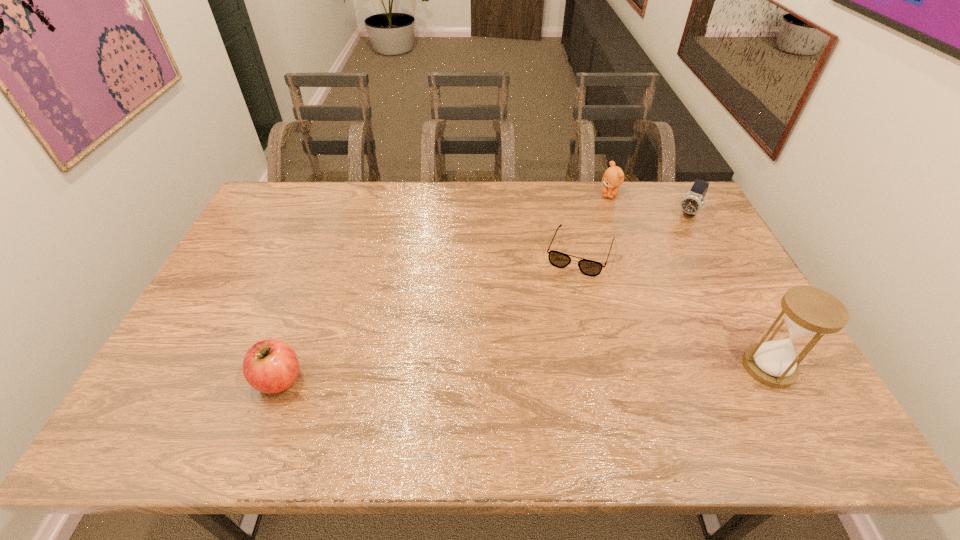
The height and width of the screenshot is (540, 960). Identify the location of vacant space at the near right corner. (770, 392).

This screenshot has width=960, height=540. Identify the location of free spot between the spectacles and the watch. (635, 233).

Identify the location of free space between the shortest object and the farthest object. (595, 224).

Find the location of a particular element. This screenshot has width=960, height=540. free space between the farthest object and the hourglass is located at coordinates (689, 281).

The height and width of the screenshot is (540, 960). In order to click on vacant space in between the second farthest object and the shortest object in this screenshot , I will do `click(635, 233)`.

The width and height of the screenshot is (960, 540). Identify the location of empty location between the tallest object and the farthest object. (689, 281).

Where is `unoccupied area between the apple and the farthest object`? This screenshot has width=960, height=540. unoccupied area between the apple and the farthest object is located at coordinates (444, 287).

Find the location of a particular element. The width and height of the screenshot is (960, 540). vacant region between the farthest object and the leftmost object is located at coordinates (444, 287).

Locate an element on the screen. free space that is in between the farthest object and the apple is located at coordinates (444, 287).

What are the coordinates of `empty space between the third nearest object and the farthest object` in the screenshot? It's located at (595, 224).